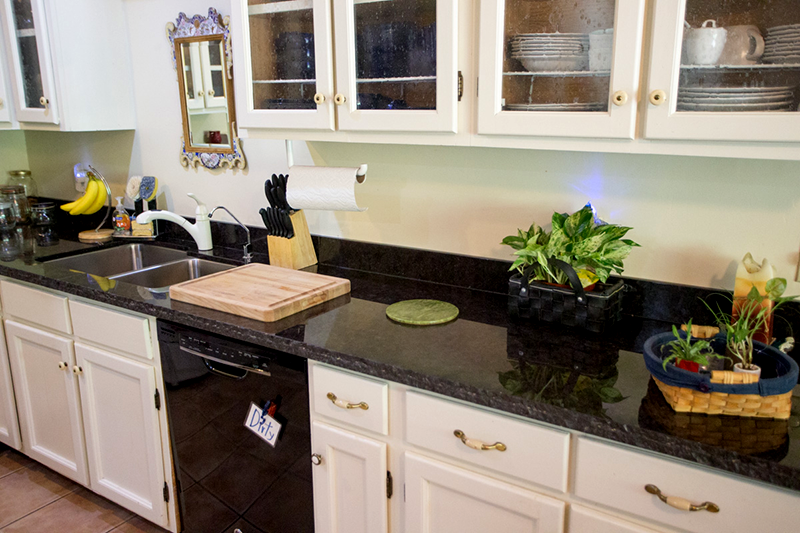
Where is `cabinets`? Image resolution: width=800 pixels, height=533 pixels. cabinets is located at coordinates (289, 54), (384, 50), (562, 39), (710, 42).